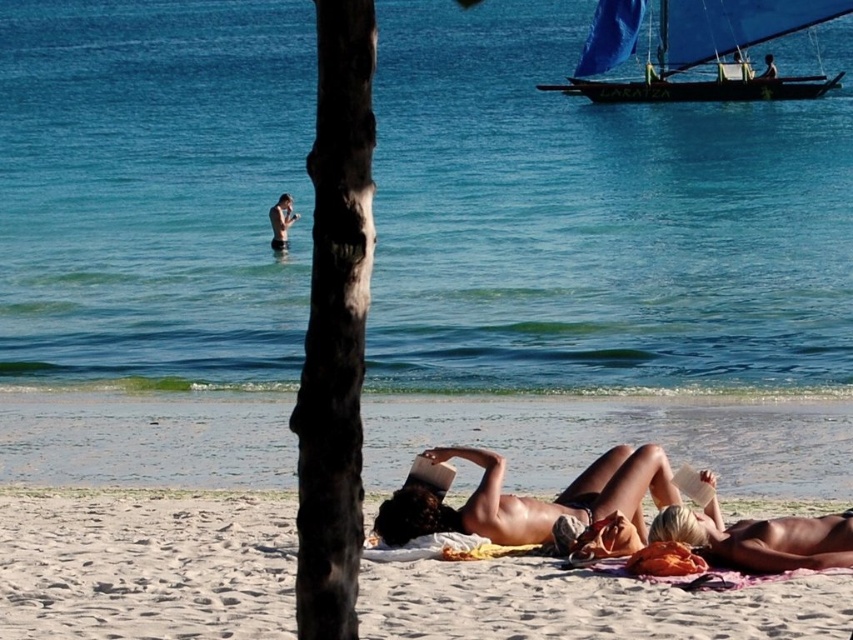
You are standing on the beach and want to take a photo of the blue sailboat at upper right. You notice a point marked at coordinates (715, 52). Where is this point located?

The point at (715, 52) is located on the blue sailboat at upper right.

You are standing at the beach scene and want to place a small flag at the point closer to you between the two points marked as point [611,38] and point [769,68]. Which point should you choose?

You should choose point [611,38] because it is closer to the camera than point [769,68].